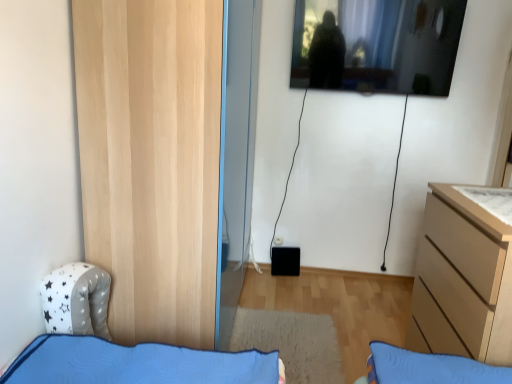
Question: Should I look upward or downward to see light wood chest of drawers at right?

Choices:
 (A) down
 (B) up

Answer: (A)

Question: Can you confirm if light wood chest of drawers at right is taller than transparent glass window at upper center?

Choices:
 (A) no
 (B) yes

Answer: (B)

Question: Can you confirm if light wood chest of drawers at right is positioned to the right of transparent glass window at upper center?

Choices:
 (A) yes
 (B) no

Answer: (A)

Question: Is there a large distance between light wood chest of drawers at right and transparent glass window at upper center?

Choices:
 (A) yes
 (B) no

Answer: (A)

Question: From the image's perspective, is light wood chest of drawers at right above transparent glass window at upper center?

Choices:
 (A) no
 (B) yes

Answer: (A)

Question: Could you tell me if light wood chest of drawers at right is turned towards transparent glass window at upper center?

Choices:
 (A) yes
 (B) no

Answer: (B)

Question: Is light wood chest of drawers at right outside of transparent glass window at upper center?

Choices:
 (A) no
 (B) yes

Answer: (B)

Question: Could you tell me if natural wood door at left is facing white matte drawer at upper right?

Choices:
 (A) no
 (B) yes

Answer: (B)

Question: Is natural wood door at left at the left side of white matte drawer at upper right?

Choices:
 (A) no
 (B) yes

Answer: (B)

Question: From a real-world perspective, is natural wood door at left located beneath white matte drawer at upper right?

Choices:
 (A) yes
 (B) no

Answer: (B)

Question: Is natural wood door at left positioned before white matte drawer at upper right?

Choices:
 (A) no
 (B) yes

Answer: (A)

Question: Can you confirm if natural wood door at left is taller than white matte drawer at upper right?

Choices:
 (A) no
 (B) yes

Answer: (B)

Question: Is natural wood door at left surrounding white matte drawer at upper right?

Choices:
 (A) no
 (B) yes

Answer: (A)

Question: From the image's perspective, is natural wood door at left below light wood chest of drawers at right?

Choices:
 (A) yes
 (B) no

Answer: (B)